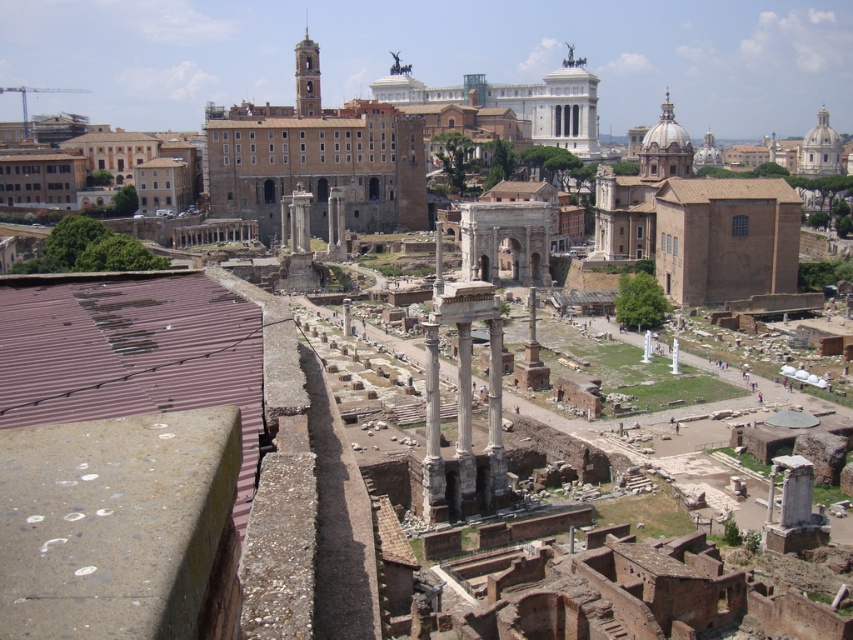
Question: Which of the following is the farthest from the observer?

Choices:
 (A) (469, 428)
 (B) (428, 387)
 (C) (674, 353)
 (D) (643, 356)

Answer: (D)

Question: Does white stone column at center appear under white marble pillar at center?

Choices:
 (A) yes
 (B) no

Answer: (A)

Question: Does white marble pillar at center appear over white glossy pillar at center?

Choices:
 (A) no
 (B) yes

Answer: (B)

Question: Which of the following is the farthest from the observer?

Choices:
 (A) white marble column at center
 (B) white stone column at center

Answer: (B)

Question: Which of the following is the farthest from the observer?

Choices:
 (A) white glossy pillar at center
 (B) white stone column at center

Answer: (A)

Question: Does smooth stone column at center appear on the left side of white glossy pillar at center?

Choices:
 (A) yes
 (B) no

Answer: (A)